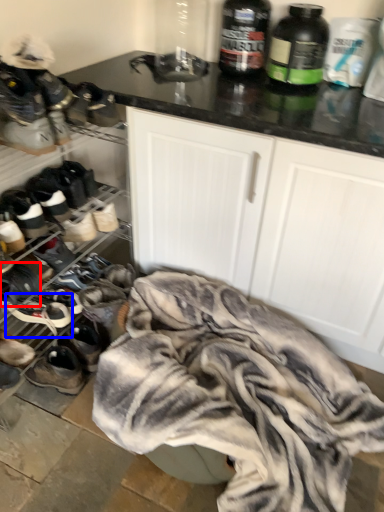
Question: Among these objects, which one is nearest to the camera, footwear (highlighted by a red box) or footwear (highlighted by a blue box)?

Choices:
 (A) footwear
 (B) footwear

Answer: (A)